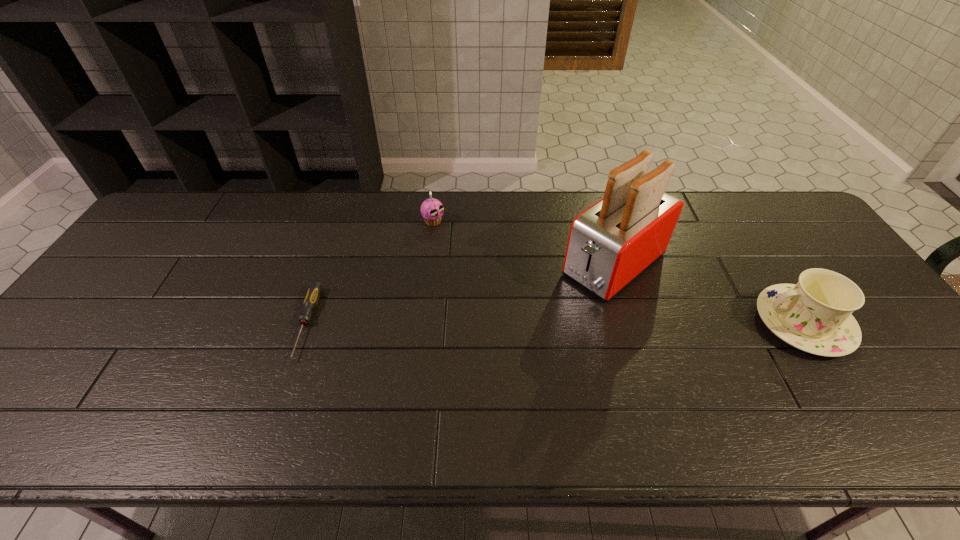
The width and height of the screenshot is (960, 540). I want to click on free spot that satisfies the following two spatial constraints: 1. insert the chinaware into a screw head; 2. on the handle side of the shortest object, so (306, 323).

I want to click on vacant space that satisfies the following two spatial constraints: 1. insert the leftmost object into a screw head; 2. on the handle side of the chinaware, so click(306, 323).

What are the coordinates of `vacant space that satisfies the following two spatial constraints: 1. insert the shortest object into a screw head; 2. on the handle side of the rightmost object` in the screenshot? It's located at 306,323.